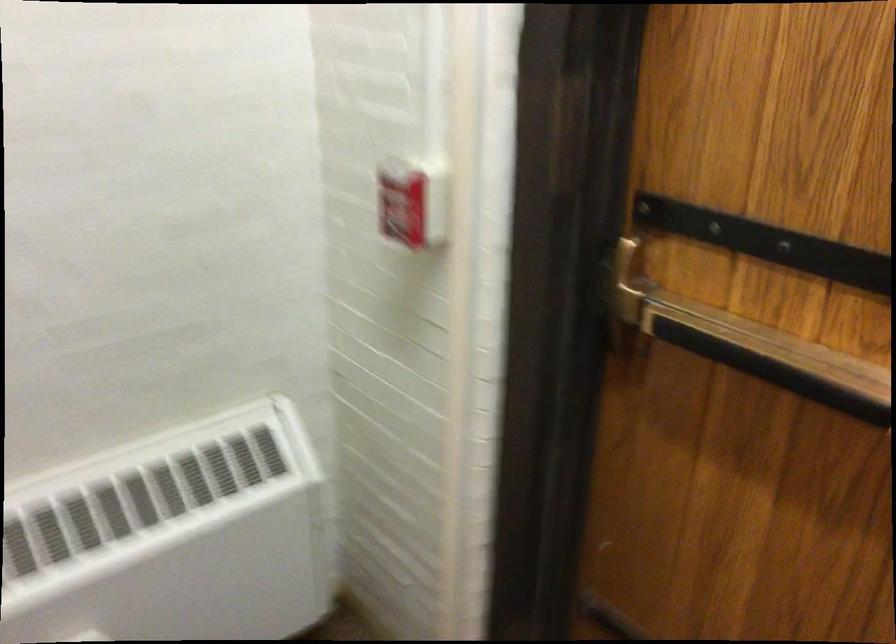
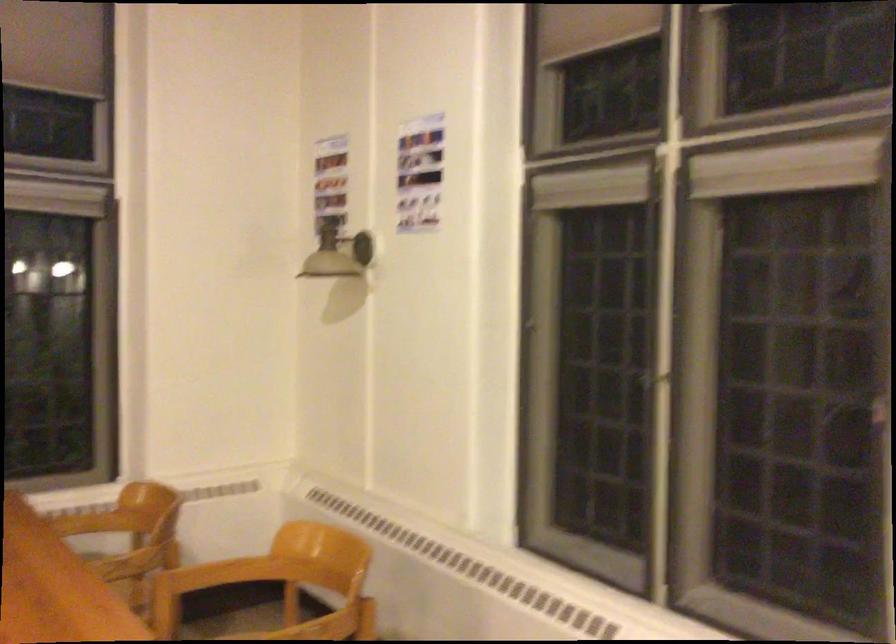
In a continuous first-person perspective shot, in which direction is the camera moving?

The cameraman moved toward left, forward.